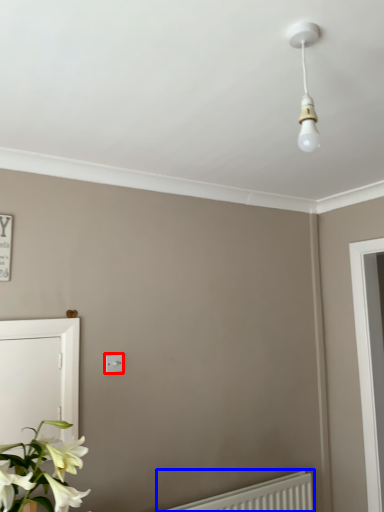
Question: Which object appears farthest to the camera in this image, light switch (highlighted by a red box) or radiator (highlighted by a blue box)?

Choices:
 (A) light switch
 (B) radiator

Answer: (A)